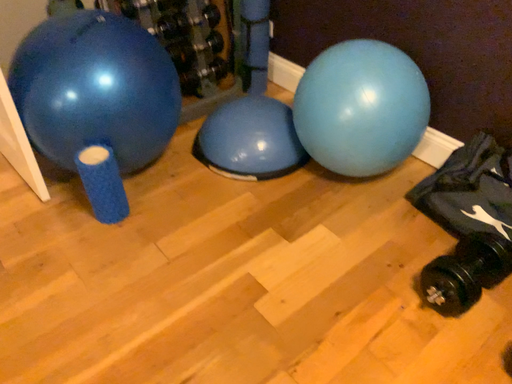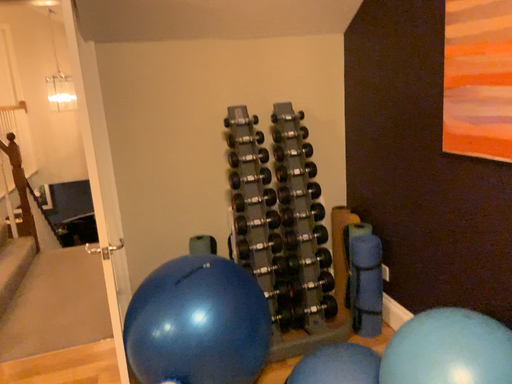
Question: Which way did the camera rotate in the video?

Choices:
 (A) rotated downward
 (B) rotated upward

Answer: (B)